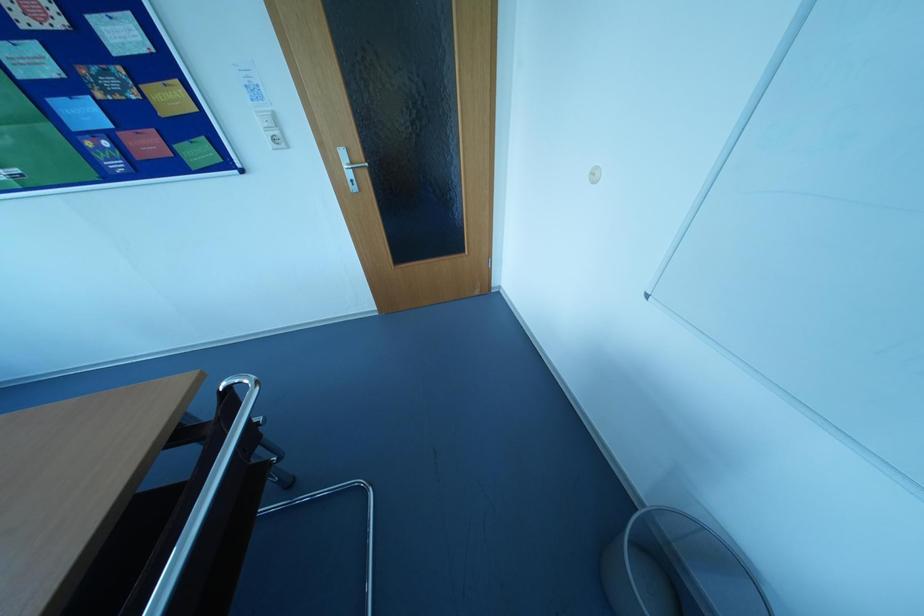
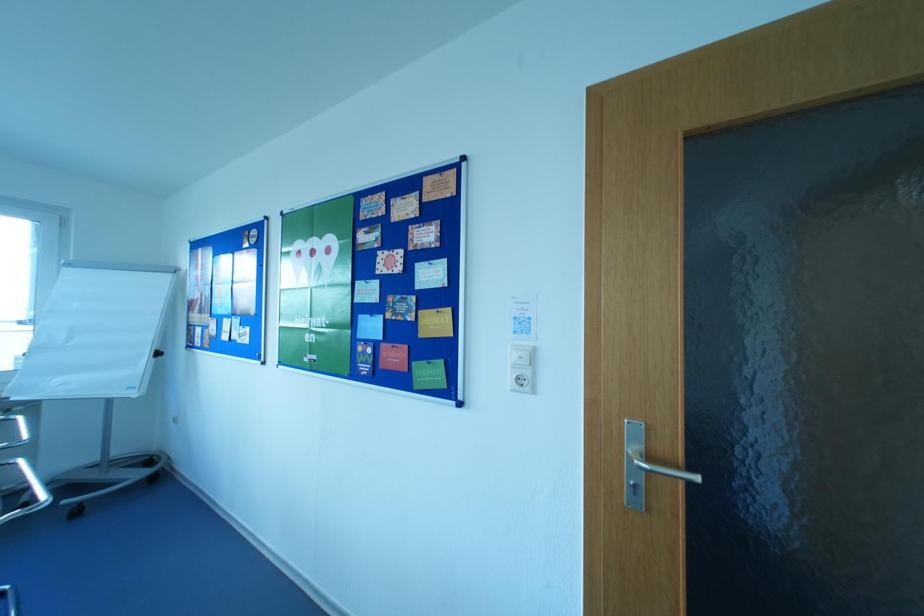
From the picture: How did the camera likely rotate?

The camera's rotation is toward left-up.